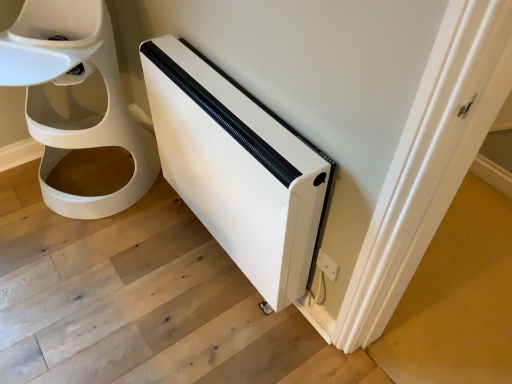
In order to face white matte heater at lower right, should I rotate leftwards or rightwards?

To face it directly, rotate left by 4.177 degrees.

What is the approximate width of white matte heater at lower right?

The width of white matte heater at lower right is 21.99 inches.

Locate an element on the screen. This screenshot has height=384, width=512. white matte heater at lower right is located at coordinates (238, 168).

In the scene shown: Could you tell me if white matte heater at lower right is facing white plastic electric outlet at lower right?

No, white matte heater at lower right is not turned towards white plastic electric outlet at lower right.

Is there a large distance between white matte heater at lower right and white plastic electric outlet at lower right?

No, white matte heater at lower right is not far from white plastic electric outlet at lower right.

Considering their positions, is white matte heater at lower right located in front of or behind white plastic electric outlet at lower right?

In the image, white matte heater at lower right appears in front of white plastic electric outlet at lower right.

Who is taller, white matte heater at lower right or white plastic electric outlet at lower right?

white matte heater at lower right.

Which is less distant, (326, 264) or (110, 125)?

Point (326, 264) appears to be closer to the viewer than point (110, 125).

In the image, is white plastic electric outlet at lower right on the left side or the right side of white matte heater at lower right?

white plastic electric outlet at lower right is positioned on white matte heater at lower right's right side.

Considering the sizes of white plastic electric outlet at lower right and white matte heater at lower right in the image, is white plastic electric outlet at lower right wider or thinner than white matte heater at lower right?

Considering their sizes, white plastic electric outlet at lower right looks slimmer than white matte heater at lower right.

Does white plastic electric outlet at lower right turn towards white matte heater at lower right?

No, white plastic electric outlet at lower right is not aimed at white matte heater at lower right.

From the image's perspective, which is below, white matte heater at lower right or white matte heater at lower right?

white matte heater at lower right, from the image's perspective.

From a real-world perspective, is white matte heater at lower right on white matte heater at lower right?

Yes.

In terms of size, does white matte heater at lower right appear bigger or smaller than white matte heater at lower right?

Considering their sizes, white matte heater at lower right takes up more space than white matte heater at lower right.

Can you tell me how much white matte heater at lower right and white matte heater at lower right differ in facing direction?

There is a 90.2-degree angle between the facing directions of white matte heater at lower right and white matte heater at lower right.

Between white matte heater at lower right and white matte heater at lower right, which one appears on the right side from the viewer's perspective?

white matte heater at lower right.

From their relative heights in the image, would you say white matte heater at lower right is taller or shorter than white matte heater at lower right?

white matte heater at lower right is shorter than white matte heater at lower right.

From a real-world perspective, which object rests below the other?

From a 3D spatial view, white matte heater at lower right is below.

How many degrees apart are the facing directions of white plastic electric outlet at lower right and white matte heater at lower right?

0.0357 degrees separate the facing orientations of white plastic electric outlet at lower right and white matte heater at lower right.

Find the location of a particular element. Image resolution: width=512 pixels, height=384 pixels. appliance above the white plastic electric outlet at lower right (from the image's perspective) is located at coordinates (238, 168).

Who is bigger, white plastic electric outlet at lower right or white matte heater at lower right?

white matte heater at lower right is bigger.

Is point (329, 261) farther from viewer compared to point (280, 196)?

Yes, point (329, 261) is farther from viewer.

Based on the photo, from a real-world perspective, which object rests below the other?

white plastic electric outlet at lower right is physically lower.

Does white matte heater at lower right have a larger size compared to white plastic electric outlet at lower right?

Yes.

Which object is positioned more to the right, white matte heater at lower right or white plastic electric outlet at lower right?

white plastic electric outlet at lower right is more to the right.

Find the location of a particular element. The height and width of the screenshot is (384, 512). electric outlet that appears below the white matte heater at lower right (from the image's perspective) is located at coordinates (327, 265).

Where is `electric outlet beneath the white matte heater at lower right (from a real-world perspective)`? The height and width of the screenshot is (384, 512). electric outlet beneath the white matte heater at lower right (from a real-world perspective) is located at coordinates (327, 265).

You are a GUI agent. You are given a task and a screenshot of the screen. Output one action in this format:
    pyautogui.click(x=<x>, y=<y>)
    Task: Click on the electric outlet on the right side of white matte heater at lower right
    
    Given the screenshot: What is the action you would take?
    (327, 265)

Looking at the image, which one is located further to white plastic electric outlet at lower right, white matte heater at lower right or white matte heater at lower right?

Among the two, white matte heater at lower right is located further to white plastic electric outlet at lower right.

Considering their positions, is white matte heater at lower right positioned further to white matte heater at lower right than white plastic electric outlet at lower right?

white matte heater at lower right is further to white matte heater at lower right.

When comparing their distances from white matte heater at lower right, does white matte heater at lower right or white plastic electric outlet at lower right seem closer?

white matte heater at lower right.

Considering their positions, is white matte heater at lower right positioned closer to white plastic electric outlet at lower right than white matte heater at lower right?

white matte heater at lower right lies closer to white plastic electric outlet at lower right than the other object.

Based on their spatial positions, is white plastic electric outlet at lower right or white matte heater at lower right further from white matte heater at lower right?

white plastic electric outlet at lower right is further to white matte heater at lower right.

Considering their positions, is white plastic electric outlet at lower right positioned further to white matte heater at lower right than white matte heater at lower right?

The object further to white matte heater at lower right is white matte heater at lower right.

You are a GUI agent. You are given a task and a screenshot of the screen. Output one action in this format:
    pyautogui.click(x=<x>, y=<y>)
    Task: Click on the appliance between white matte heater at lower right and white plastic electric outlet at lower right from left to right
    This screenshot has width=512, height=384.
    Given the screenshot: What is the action you would take?
    pyautogui.click(x=238, y=168)